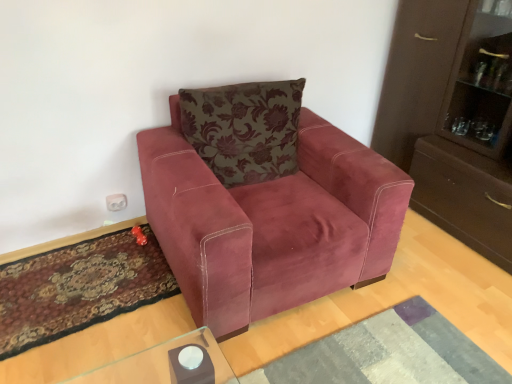
Question: From a real-world perspective, relative to textured gray mat at lower center, which is counted as the first mat, starting from the right, is velvet floral pillow at center vertically above or below?

Choices:
 (A) below
 (B) above

Answer: (B)

Question: From the image's perspective, relative to textured gray mat at lower center, placed as the second mat when sorted from left to right, is velvet floral pillow at center above or below?

Choices:
 (A) below
 (B) above

Answer: (B)

Question: Which object is the closest to the velvet pink armchair at center?

Choices:
 (A) carpeted rug at lower left, which ranks as the first mat in left-to-right order
 (B) textured gray mat at lower center, placed as the second mat when sorted from left to right
 (C) velvet floral pillow at center

Answer: (C)

Question: Estimate the real-world distances between objects in this image. Which object is closer to the textured gray mat at lower center, placed as the second mat when sorted from left to right?

Choices:
 (A) carpeted rug at lower left, which ranks as the first mat in left-to-right order
 (B) velvet floral pillow at center
 (C) velvet pink armchair at center

Answer: (C)